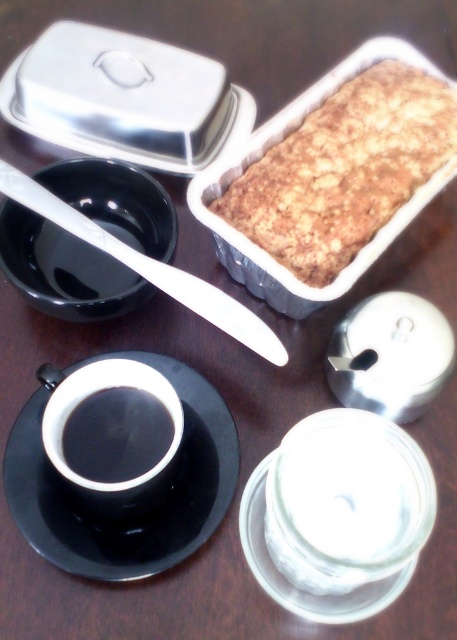
Question: Estimate the real-world distances between objects in this image. Which object is closer to the white plastic knife at upper left?

Choices:
 (A) brushed metal container at upper left
 (B) black ceramic saucer at center
 (C) black glossy cup at center
 (D) black glossy saucer at upper left

Answer: (D)

Question: Where is golden crumbly bread at center located in relation to brushed metal container at upper left in the image?

Choices:
 (A) above
 (B) below

Answer: (B)

Question: Does golden crumbly bread at center have a lesser width compared to black glossy cup at center?

Choices:
 (A) yes
 (B) no

Answer: (B)

Question: Does black glossy saucer at upper left appear on the right side of white plastic knife at upper left?

Choices:
 (A) no
 (B) yes

Answer: (A)

Question: Estimate the real-world distances between objects in this image. Which object is closer to the black glossy cup at center?

Choices:
 (A) brushed metal container at upper left
 (B) black ceramic saucer at center

Answer: (B)

Question: Which point is closer to the camera?

Choices:
 (A) black glossy cup at center
 (B) white plastic knife at upper left
 (C) brushed metal container at upper left

Answer: (A)